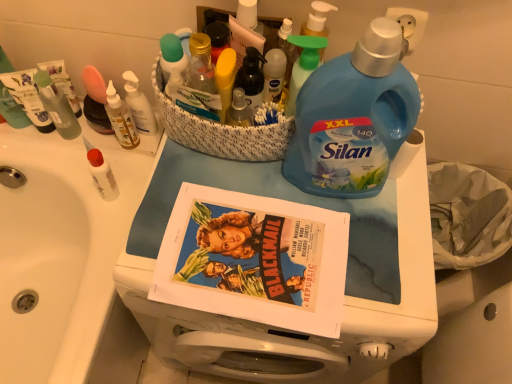
Locate an element on the screen. free location above matte paper comic book at center (from a real-world perspective) is located at coordinates (222, 220).